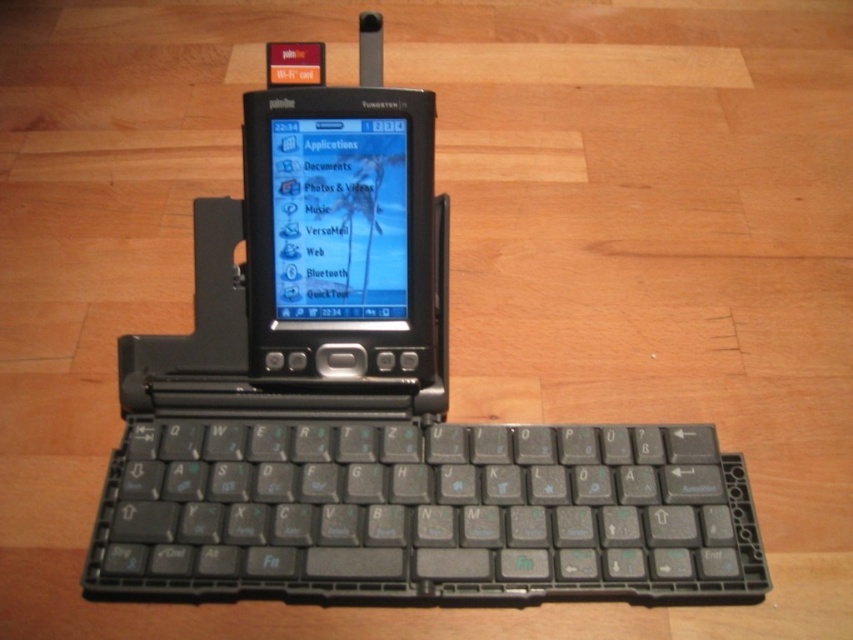
Does black plastic keyboard at center have a lesser height compared to matte plastic screen at center?

Yes, black plastic keyboard at center is shorter than matte plastic screen at center.

Is black plastic keyboard at center further to the viewer compared to matte plastic screen at center?

That is False.

Which is in front, point (129, 445) or point (337, 282)?

Positioned in front is point (129, 445).

At what (x,y) coordinates should I click in order to perform the action: click on black plastic keyboard at center. Please return your answer as a coordinate pair (x, y). The width and height of the screenshot is (853, 640). Looking at the image, I should click on (422, 512).